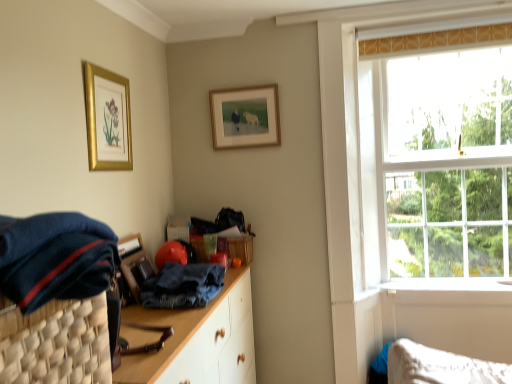
Question: Is dark blue woven basket at left positioned beyond the bounds of gold metallic picture frame at upper left, the second picture frame positioned from the right?

Choices:
 (A) yes
 (B) no

Answer: (A)

Question: Considering the relative sizes of dark blue woven basket at left and gold metallic picture frame at upper left, the second picture frame positioned from the right, in the image provided, is dark blue woven basket at left bigger than gold metallic picture frame at upper left, the second picture frame positioned from the right,?

Choices:
 (A) no
 (B) yes

Answer: (B)

Question: Does dark blue woven basket at left appear on the left side of gold metallic picture frame at upper left, which is counted as the second picture frame, starting from the back?

Choices:
 (A) yes
 (B) no

Answer: (B)

Question: Could you tell me if dark blue woven basket at left is facing gold metallic picture frame at upper left, which is the 1th picture frame from left to right?

Choices:
 (A) no
 (B) yes

Answer: (A)

Question: Are dark blue woven basket at left and gold metallic picture frame at upper left, the second picture frame positioned from the right, located far from each other?

Choices:
 (A) no
 (B) yes

Answer: (B)

Question: Does dark blue woven basket at left have a lesser width compared to gold metallic picture frame at upper left, which is counted as the second picture frame, starting from the back?

Choices:
 (A) no
 (B) yes

Answer: (A)

Question: Does dark blue fabric at left, which is the 1th clothing in top-to-bottom order, have a lesser width compared to dark blue woven basket at left?

Choices:
 (A) no
 (B) yes

Answer: (A)

Question: From a real-world perspective, is dark blue fabric at left, which is counted as the 2th clothing, starting from the bottom, over dark blue woven basket at left?

Choices:
 (A) no
 (B) yes

Answer: (B)

Question: Considering the relative sizes of dark blue fabric at left, positioned as the first clothing in front-to-back order, and dark blue woven basket at left in the image provided, is dark blue fabric at left, positioned as the first clothing in front-to-back order, shorter than dark blue woven basket at left?

Choices:
 (A) yes
 (B) no

Answer: (A)

Question: Can you confirm if dark blue fabric at left, which is the 1th clothing in top-to-bottom order, is smaller than dark blue woven basket at left?

Choices:
 (A) yes
 (B) no

Answer: (A)

Question: From the image's perspective, does dark blue fabric at left, which is the 1th clothing in top-to-bottom order, appear higher than dark blue woven basket at left?

Choices:
 (A) no
 (B) yes

Answer: (B)

Question: Is dark blue fabric at left, which is counted as the 2th clothing, starting from the bottom, aimed at dark blue woven basket at left?

Choices:
 (A) no
 (B) yes

Answer: (A)

Question: Considering the relative positions of clear glass window at upper right and gold metallic picture frame at upper left, which is the 1th picture frame from left to right, in the image provided, is clear glass window at upper right to the right of gold metallic picture frame at upper left, which is the 1th picture frame from left to right, from the viewer's perspective?

Choices:
 (A) no
 (B) yes

Answer: (B)